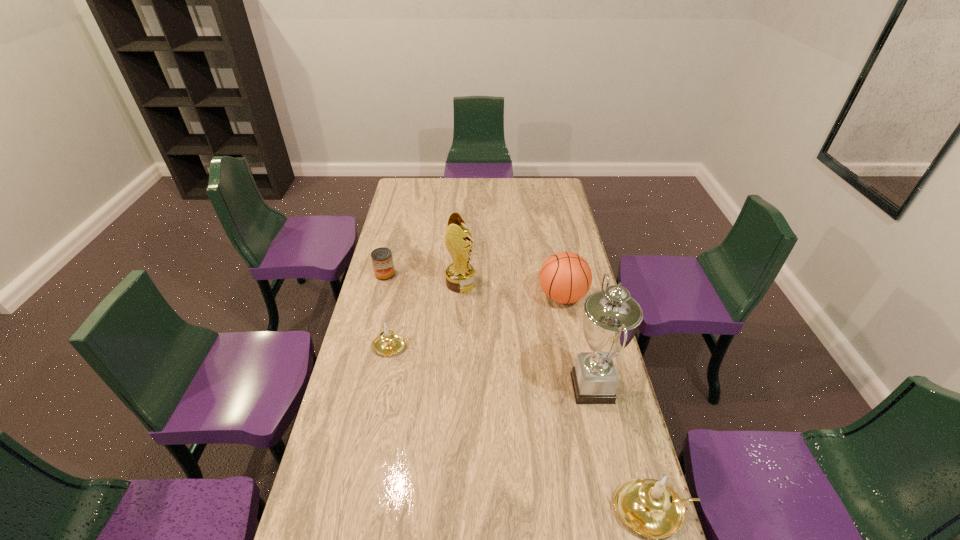
This screenshot has height=540, width=960. I want to click on vacant area located on the back of the can, so click(399, 217).

Locate an element on the screen. The height and width of the screenshot is (540, 960). vacant space located at the front view of the trophy cup is located at coordinates pyautogui.click(x=503, y=387).

The height and width of the screenshot is (540, 960). I want to click on vacant space located at the front view of the trophy cup, so click(485, 387).

At what (x,y) coordinates should I click in order to perform the action: click on vacant space located at the front view of the trophy cup. Please return your answer as a coordinate pair (x, y). This screenshot has width=960, height=540. Looking at the image, I should click on (445, 387).

Locate an element on the screen. The image size is (960, 540). candle holder present at the left edge is located at coordinates (388, 343).

This screenshot has width=960, height=540. Find the location of `can present at the left edge`. can present at the left edge is located at coordinates (382, 260).

Where is `basketball that is at the right edge`? The image size is (960, 540). basketball that is at the right edge is located at coordinates (565, 277).

Where is `trophy cup that is at the right edge`? Image resolution: width=960 pixels, height=540 pixels. trophy cup that is at the right edge is located at coordinates (611, 317).

Identify the location of blank area at the far edge. (446, 189).

In the image, there is a desktop. At what (x,y) coordinates should I click in order to perform the action: click on vacant space at the left edge. Please return your answer as a coordinate pair (x, y). This screenshot has width=960, height=540. Looking at the image, I should click on (392, 241).